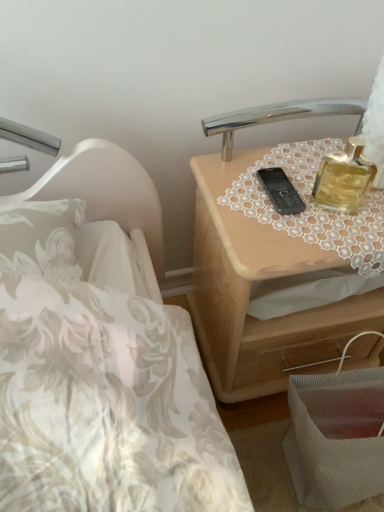
At what (x,y) coordinates should I click in order to perform the action: click on blank space situated above light wood nightstand at upper right (from a real-world perspective). Please return your answer as a coordinate pair (x, y). This screenshot has width=384, height=512. Looking at the image, I should click on (304, 188).